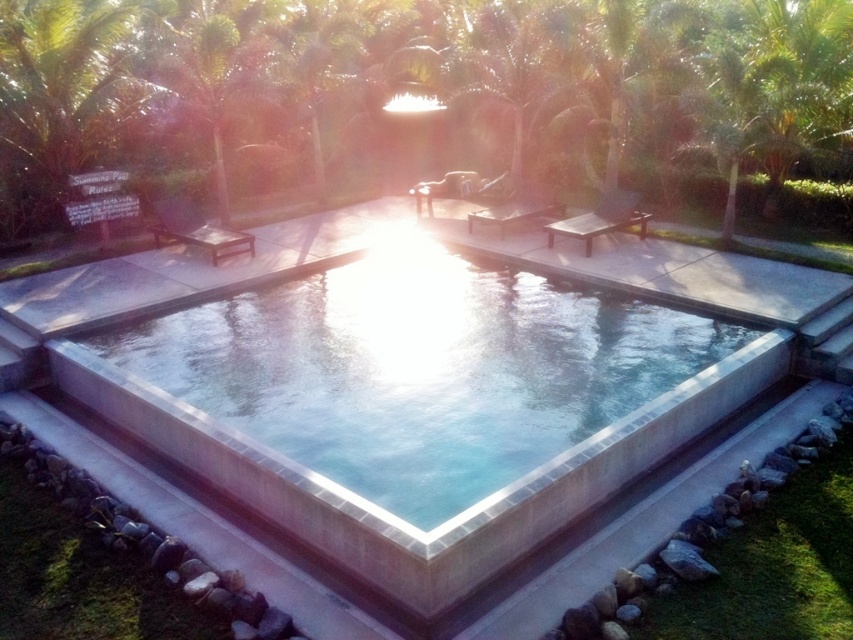
Question: Which of the following is the farthest from the observer?

Choices:
 (A) green leafy tree at upper center
 (B) matte brown lounge chair at center
 (C) smooth concrete pool at center

Answer: (B)

Question: Which object is closer to the camera taking this photo?

Choices:
 (A) smooth concrete pool at center
 (B) green leafy tree at upper center
 (C) matte brown lounge chair at center

Answer: (A)

Question: Is green leafy tree at upper center to the right of smooth concrete pool at center from the viewer's perspective?

Choices:
 (A) no
 (B) yes

Answer: (B)

Question: Is smooth concrete pool at center positioned before matte brown lounge chair at center?

Choices:
 (A) no
 (B) yes

Answer: (B)

Question: Which point is closer to the camera?

Choices:
 (A) matte brown lounge chair at center
 (B) green leafy tree at upper center
 (C) smooth concrete pool at center

Answer: (C)

Question: Can you confirm if smooth concrete pool at center is positioned above matte brown lounge chair at center?

Choices:
 (A) no
 (B) yes

Answer: (A)